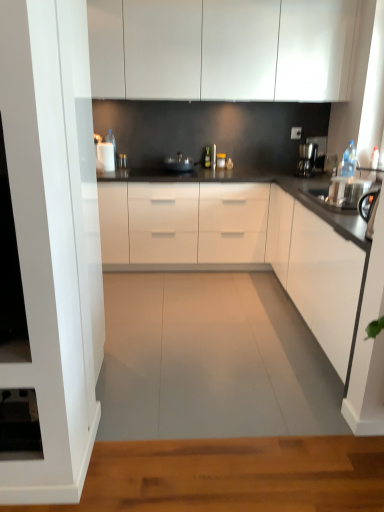
Question: Does sleek black coffee machine at right have a lesser width compared to metallic silver pan at center?

Choices:
 (A) no
 (B) yes

Answer: (B)

Question: Does sleek black coffee machine at right contain metallic silver pan at center?

Choices:
 (A) yes
 (B) no

Answer: (B)

Question: Can you confirm if sleek black coffee machine at right is positioned to the right of metallic silver pan at center?

Choices:
 (A) no
 (B) yes

Answer: (B)

Question: Is the depth of sleek black coffee machine at right less than that of metallic silver pan at center?

Choices:
 (A) yes
 (B) no

Answer: (A)

Question: From a real-world perspective, is sleek black coffee machine at right physically below metallic silver pan at center?

Choices:
 (A) yes
 (B) no

Answer: (B)

Question: Based on their positions, is black glossy countertop at center, the 1th countertop in the front-to-back sequence, located to the left or right of white glossy cabinets at upper center, placed as the 2th cabinetry when sorted from bottom to top?

Choices:
 (A) right
 (B) left

Answer: (B)

Question: Considering the positions of black glossy countertop at center, positioned as the second countertop in back-to-front order, and white glossy cabinets at upper center, the first cabinetry in the top-to-bottom sequence, in the image, is black glossy countertop at center, positioned as the second countertop in back-to-front order, taller or shorter than white glossy cabinets at upper center, the first cabinetry in the top-to-bottom sequence,?

Choices:
 (A) short
 (B) tall

Answer: (B)

Question: Which is correct: black glossy countertop at center, the 1th countertop in the front-to-back sequence, is inside white glossy cabinets at upper center, the first cabinetry in the top-to-bottom sequence, or outside of it?

Choices:
 (A) outside
 (B) inside

Answer: (A)

Question: From a real-world perspective, is black glossy countertop at center, the 1th countertop in the front-to-back sequence, above or below white glossy cabinets at upper center, placed as the 2th cabinetry when sorted from bottom to top?

Choices:
 (A) above
 (B) below

Answer: (B)

Question: Relative to metallic silver pan at center, is white glossy countertop at center, the first countertop in the back-to-front sequence, in front or behind?

Choices:
 (A) behind
 (B) front

Answer: (B)

Question: Considering the positions of white glossy countertop at center, the first countertop in the back-to-front sequence, and metallic silver pan at center in the image, is white glossy countertop at center, the first countertop in the back-to-front sequence, bigger or smaller than metallic silver pan at center?

Choices:
 (A) small
 (B) big

Answer: (B)

Question: From a real-world perspective, is white glossy countertop at center, the first countertop in the back-to-front sequence, physically located above or below metallic silver pan at center?

Choices:
 (A) above
 (B) below

Answer: (B)

Question: Based on their positions, is white glossy countertop at center, which is the second countertop in front-to-back order, located to the left or right of metallic silver pan at center?

Choices:
 (A) left
 (B) right

Answer: (B)

Question: Does point (263, 176) appear closer or farther from the camera than point (271, 258)?

Choices:
 (A) closer
 (B) farther

Answer: (B)

Question: In terms of size, does white glossy countertop at center, which is the second countertop in front-to-back order, appear bigger or smaller than black glossy countertop at center, positioned as the second countertop in back-to-front order?

Choices:
 (A) small
 (B) big

Answer: (A)